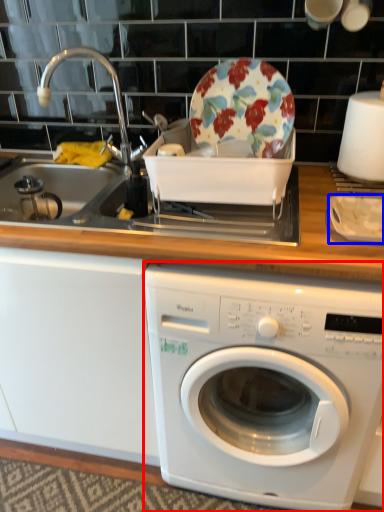
Question: Which of the following is the farthest to the observer, washing machine (highlighted by a red box) or tableware (highlighted by a blue box)?

Choices:
 (A) washing machine
 (B) tableware

Answer: (B)